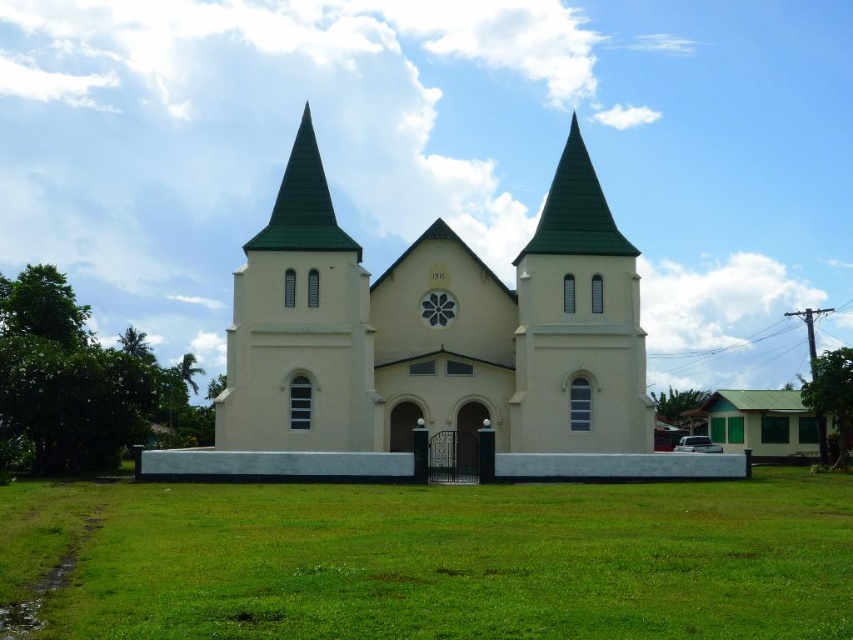
Question: Does green grass at center come in front of beige concrete church at center?

Choices:
 (A) yes
 (B) no

Answer: (A)

Question: Can you confirm if green grass at center is smaller than beige concrete church at center?

Choices:
 (A) yes
 (B) no

Answer: (A)

Question: Does green grass at center appear on the right side of beige concrete church at center?

Choices:
 (A) no
 (B) yes

Answer: (A)

Question: Which point appears farthest from the camera in this image?

Choices:
 (A) (701, 490)
 (B) (599, 316)

Answer: (B)